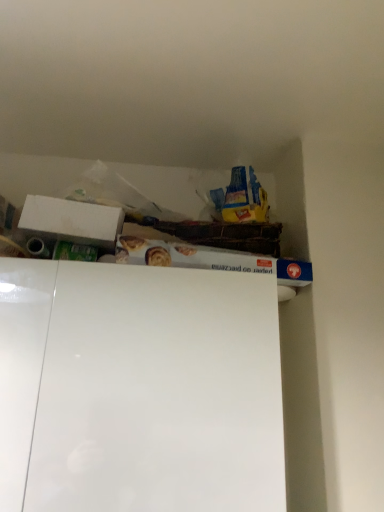
Question: From the image's perspective, is white cardboard box at upper left over white glossy cabinet at upper center?

Choices:
 (A) yes
 (B) no

Answer: (A)

Question: From a real-world perspective, is white cardboard box at upper left on top of white glossy cabinet at upper center?

Choices:
 (A) no
 (B) yes

Answer: (B)

Question: Is white cardboard box at upper left far away from white glossy cabinet at upper center?

Choices:
 (A) yes
 (B) no

Answer: (B)

Question: Can you confirm if white cardboard box at upper left is positioned to the right of white glossy cabinet at upper center?

Choices:
 (A) no
 (B) yes

Answer: (A)

Question: Is white cardboard box at upper left bigger than white glossy cabinet at upper center?

Choices:
 (A) yes
 (B) no

Answer: (B)

Question: Is white glossy cabinet at upper center inside white cardboard box at upper left?

Choices:
 (A) yes
 (B) no

Answer: (B)

Question: Is there a large distance between white glossy cabinet at upper center and white cardboard box at upper left?

Choices:
 (A) yes
 (B) no

Answer: (B)

Question: From the image's perspective, is white glossy cabinet at upper center over white cardboard box at upper left?

Choices:
 (A) yes
 (B) no

Answer: (B)

Question: Does white glossy cabinet at upper center lie behind white cardboard box at upper left?

Choices:
 (A) yes
 (B) no

Answer: (B)

Question: Is white glossy cabinet at upper center touching white cardboard box at upper left?

Choices:
 (A) yes
 (B) no

Answer: (B)

Question: Considering the relative positions of white glossy cabinet at upper center and white cardboard box at upper left in the image provided, is white glossy cabinet at upper center to the left of white cardboard box at upper left from the viewer's perspective?

Choices:
 (A) yes
 (B) no

Answer: (B)

Question: Is white cardboard box at upper left surrounded by white glossy cabinet at upper center?

Choices:
 (A) yes
 (B) no

Answer: (B)

Question: Would you say white glossy cabinet at upper center is inside or outside white cardboard box at upper left?

Choices:
 (A) inside
 (B) outside

Answer: (B)